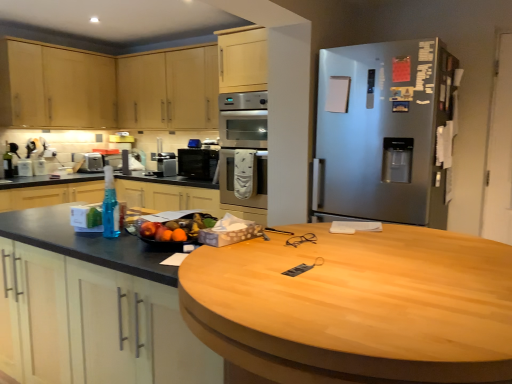
Question: Is shiny plastic bowl of mixed fruits at center with green glass bottle at left, marked as the 2th bottle in a right-to-left arrangement?

Choices:
 (A) yes
 (B) no

Answer: (B)

Question: Is shiny plastic bowl of mixed fruits at center far from green glass bottle at left, marked as the 2th bottle in a right-to-left arrangement?

Choices:
 (A) no
 (B) yes

Answer: (B)

Question: From the image's perspective, is shiny plastic bowl of mixed fruits at center located above green glass bottle at left, arranged as the 2th bottle when ordered from the bottom?

Choices:
 (A) yes
 (B) no

Answer: (B)

Question: Can you confirm if shiny plastic bowl of mixed fruits at center is taller than green glass bottle at left, the second bottle viewed from the front?

Choices:
 (A) yes
 (B) no

Answer: (B)

Question: From a real-world perspective, is shiny plastic bowl of mixed fruits at center physically below green glass bottle at left, the first bottle from the left?

Choices:
 (A) yes
 (B) no

Answer: (A)

Question: Is shiny plastic bowl of mixed fruits at center outside of green glass bottle at left, the first bottle from the left?

Choices:
 (A) yes
 (B) no

Answer: (A)

Question: From a real-world perspective, is satin black coffee maker at center, marked as the 2th appliance in a left-to-right arrangement, located higher than satin silver toaster at left, the first appliance from the back?

Choices:
 (A) yes
 (B) no

Answer: (A)

Question: Is satin silver toaster at left, positioned as the 2th appliance in front-to-back order, completely or partially inside satin black coffee maker at center, acting as the first appliance starting from the front?

Choices:
 (A) no
 (B) yes

Answer: (A)

Question: From the image's perspective, would you say satin black coffee maker at center, acting as the 2th appliance starting from the back, is shown under satin silver toaster at left, the first appliance from the back?

Choices:
 (A) no
 (B) yes

Answer: (B)

Question: Is satin black coffee maker at center, acting as the first appliance starting from the right, oriented towards satin silver toaster at left, positioned as the 2th appliance in front-to-back order?

Choices:
 (A) no
 (B) yes

Answer: (A)

Question: Considering the relative positions of satin black coffee maker at center, acting as the first appliance starting from the right, and satin silver toaster at left, positioned as the second appliance in right-to-left order, in the image provided, is satin black coffee maker at center, acting as the first appliance starting from the right, to the left of satin silver toaster at left, positioned as the second appliance in right-to-left order, from the viewer's perspective?

Choices:
 (A) no
 (B) yes

Answer: (A)

Question: Is satin silver toaster at left, the first appliance from the back, at the back of satin black coffee maker at center, marked as the 2th appliance in a left-to-right arrangement?

Choices:
 (A) yes
 (B) no

Answer: (B)

Question: Would you say satin silver toaster at left, positioned as the 2th appliance in front-to-back order, is part of matte black countertop at left's contents?

Choices:
 (A) yes
 (B) no

Answer: (B)